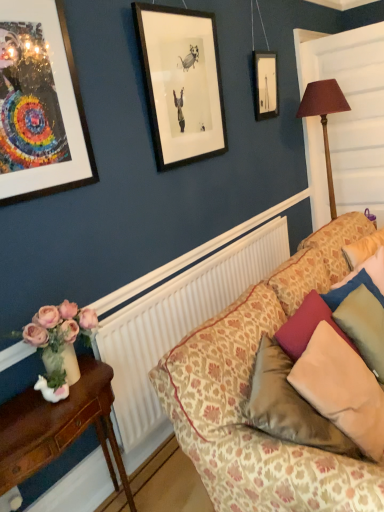
Question: In the image, is velvet green pillow at right, which is the second pillow from left to right, on the left side or the right side of brown fabric lampshade at right?

Choices:
 (A) left
 (B) right

Answer: (A)

Question: From their relative heights in the image, would you say velvet green pillow at right, which appears as the first pillow when viewed from the right, is taller or shorter than brown fabric lampshade at right?

Choices:
 (A) tall
 (B) short

Answer: (B)

Question: Estimate the real-world distances between objects in this image. Which object is closer to the velvet green pillow at right, which appears as the first pillow when viewed from the right?

Choices:
 (A) patterned fabric couch at lower right
 (B) velvet beige pillow at lower right, arranged as the first pillow when viewed from the left
 (C) brown wooden table at lower left
 (D) white textured radiator at center
 (E) metallic gold picture frame at upper left

Answer: (A)

Question: Which is farther from the velvet green pillow at right, which is the second pillow from left to right?

Choices:
 (A) brown wooden table at lower left
 (B) velvet beige pillow at lower right, arranged as the first pillow when viewed from the left
 (C) white textured radiator at center
 (D) patterned fabric couch at lower right
 (E) brown fabric lampshade at right

Answer: (E)